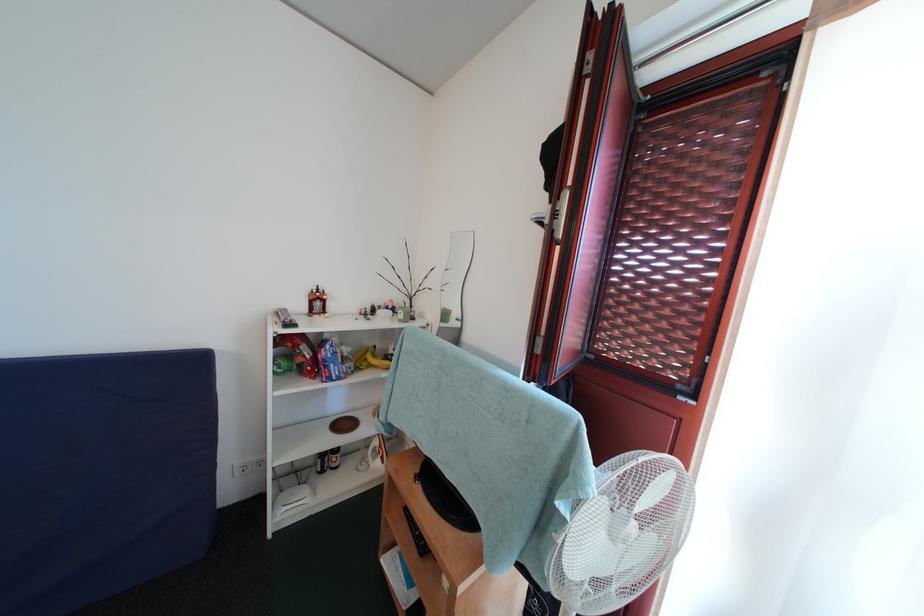
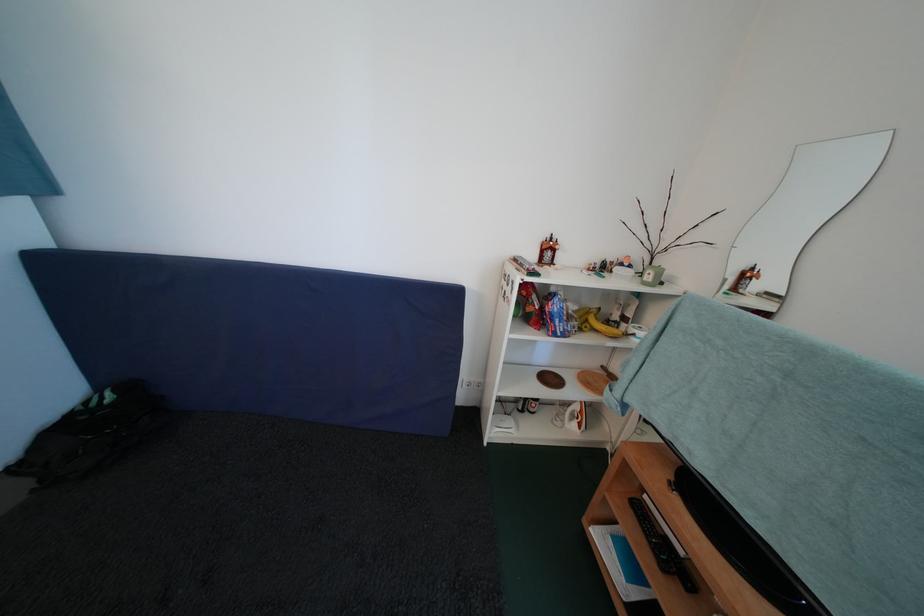
The point at (307,312) is marked in the first image. Where is the corresponding point in the second image?

(539, 261)